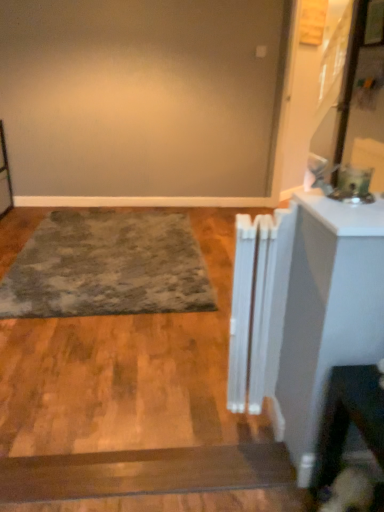
Question: From their relative heights in the image, would you say white plastic radiator at center is taller or shorter than textured gray rug at center?

Choices:
 (A) tall
 (B) short

Answer: (A)

Question: Based on their sizes in the image, would you say white plastic radiator at center is bigger or smaller than textured gray rug at center?

Choices:
 (A) big
 (B) small

Answer: (B)

Question: Estimate the real-world distances between objects in this image. Which object is closer to the white glossy counter top at right?

Choices:
 (A) fuzzy brown dog at lower right
 (B) white plastic radiator at center
 (C) textured gray rug at center

Answer: (B)

Question: Based on their relative distances, which object is farther from the fuzzy brown dog at lower right?

Choices:
 (A) textured gray rug at center
 (B) white plastic radiator at center
 (C) white glossy counter top at right

Answer: (A)